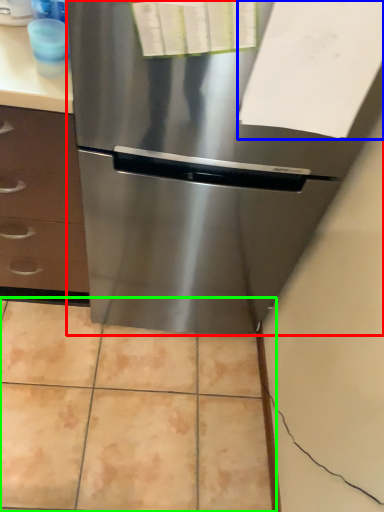
Question: Which is nearer to the refrigerator (highlighted by a red box)? paper (highlighted by a blue box) or ceramic tile (highlighted by a green box).

Choices:
 (A) paper
 (B) ceramic tile

Answer: (A)